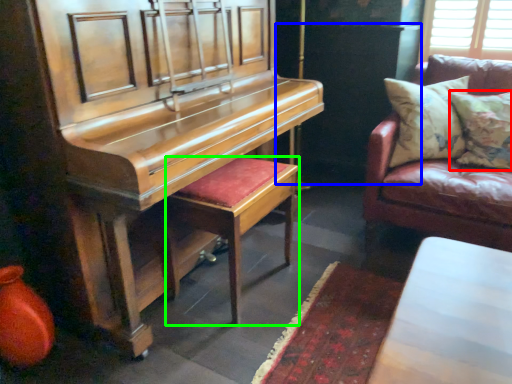
Question: Based on their relative distances, which object is farther from pillow (highlighted by a red box)? Choose from dark (highlighted by a blue box) and stool (highlighted by a green box).

Choices:
 (A) dark
 (B) stool

Answer: (B)